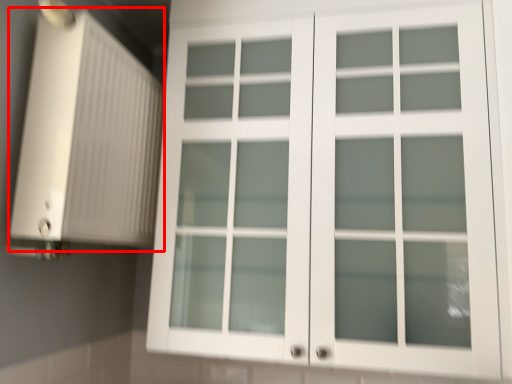
Question: From the image's perspective, what is the correct spatial relationship of air conditioning (annotated by the red box) in relation to cupboard?

Choices:
 (A) above
 (B) below

Answer: (A)